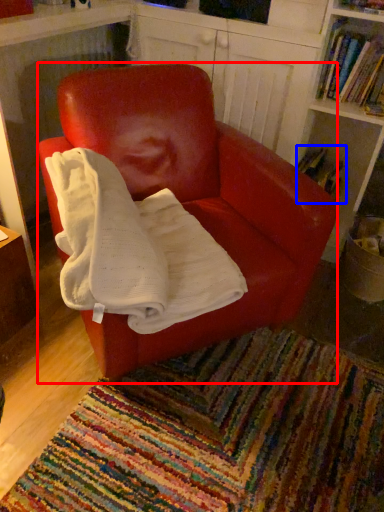
Question: Which point is closer to the camera, chair (highlighted by a red box) or book (highlighted by a blue box)?

Choices:
 (A) chair
 (B) book

Answer: (A)